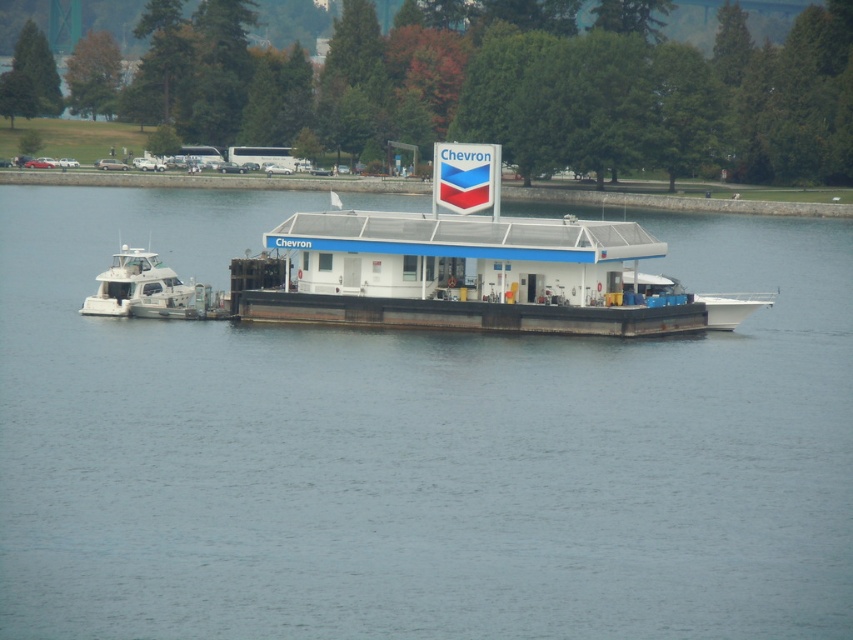
Can you confirm if white matte water at center is positioned to the left of white glossy boat at left?

No, white matte water at center is not to the left of white glossy boat at left.

Does white matte water at center appear on the right side of white glossy boat at left?

Correct, you'll find white matte water at center to the right of white glossy boat at left.

Locate an element on the screen. white matte water at center is located at coordinates (415, 449).

This screenshot has width=853, height=640. Identify the location of white matte water at center. (415, 449).